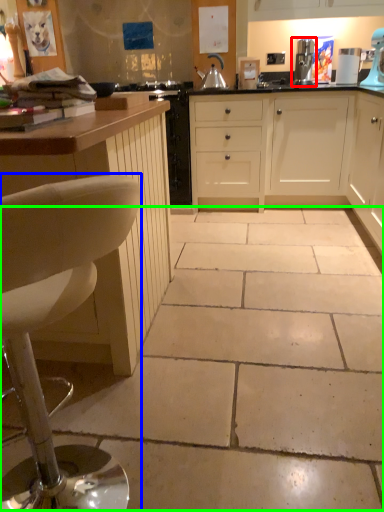
Question: Which object is positioned closest to kitchen appliance (highlighted by a red box)? Select from chair (highlighted by a blue box) and concrete (highlighted by a green box).

Choices:
 (A) chair
 (B) concrete

Answer: (B)